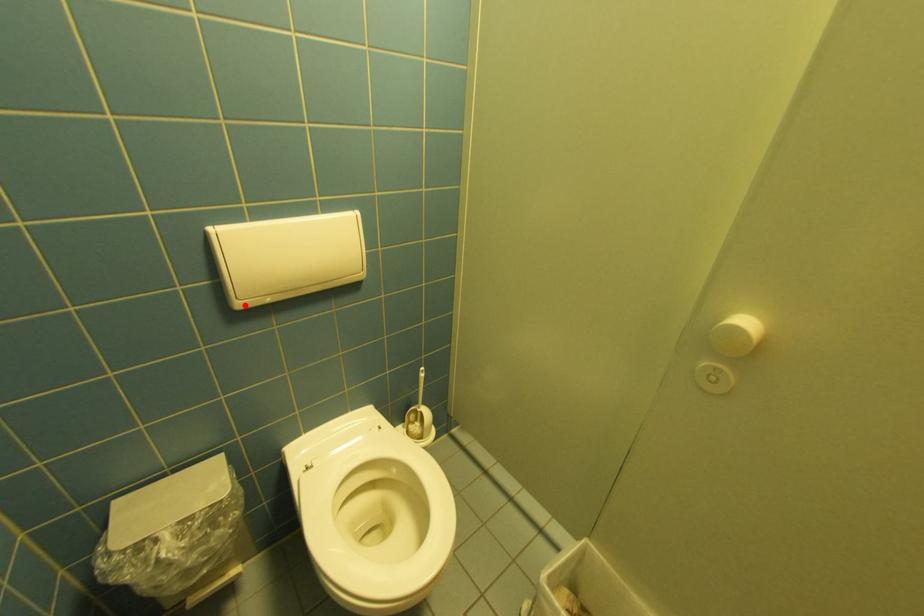
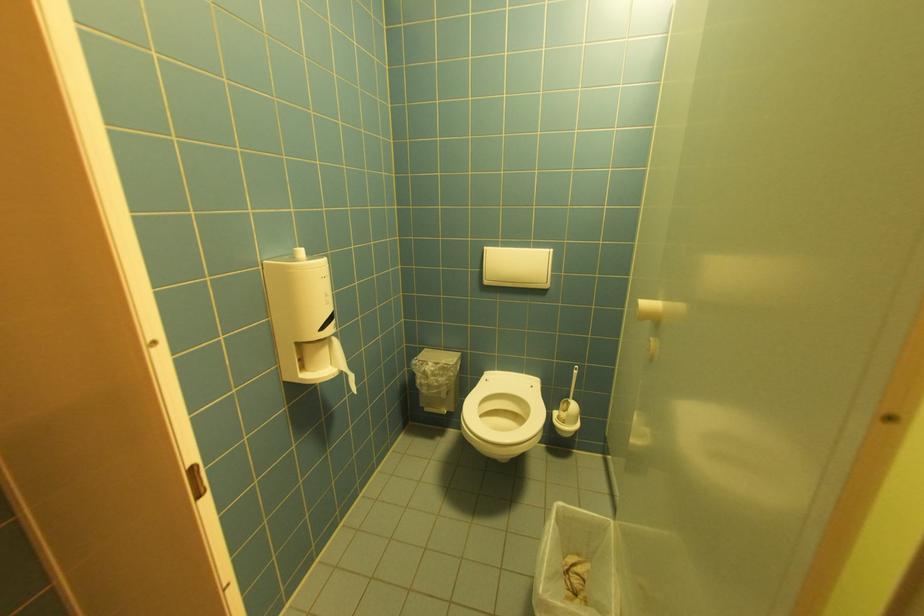
Find the pixel in the second image that matches the highlighted location in the first image.

(492, 283)